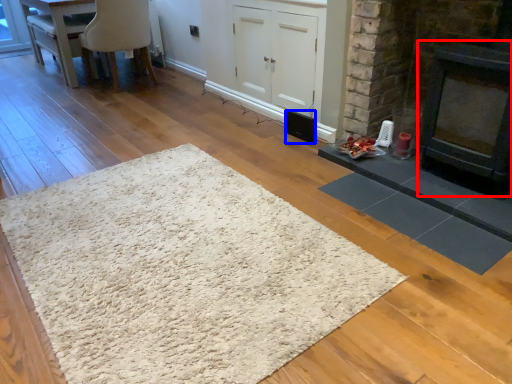
Question: Which point is closer to the camera, fireplace (highlighted by a red box) or speaker (highlighted by a blue box)?

Choices:
 (A) fireplace
 (B) speaker

Answer: (A)